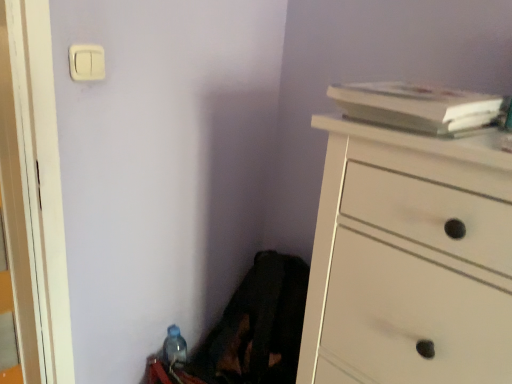
Describe the element at coordinates (174, 348) in the screenshot. I see `translucent plastic bottle at lower left` at that location.

Based on the photo, in order to face white matte book at upper right, should I rotate leftwards or rightwards?

Rotate right and turn 20.868 degrees.

You are a GUI agent. You are given a task and a screenshot of the screen. Output one action in this format:
    pyautogui.click(x=<x>, y=<y>)
    Task: Click on the white wood chest of drawers at right
    This screenshot has width=512, height=384.
    Given the screenshot: What is the action you would take?
    410,259

Who is shorter, white wood chest of drawers at right or translucent plastic bottle at lower left?

translucent plastic bottle at lower left is shorter.

How different are the orientations of white wood chest of drawers at right and translucent plastic bottle at lower left in degrees?

The angle between the facing direction of white wood chest of drawers at right and the facing direction of translucent plastic bottle at lower left is 91.9 degrees.

Is the depth of white wood chest of drawers at right less than that of translucent plastic bottle at lower left?

Yes, it is in front of translucent plastic bottle at lower left.

Does white wood chest of drawers at right appear on the left side of translucent plastic bottle at lower left?

No.

Is white plastic light switch at upper left to the right of white wood chest of drawers at right from the viewer's perspective?

No.

From a real-world perspective, between white plastic light switch at upper left and white wood chest of drawers at right, who is vertically lower?

In real-world perspective, white wood chest of drawers at right is lower.

From the image's perspective, is white plastic light switch at upper left beneath white wood chest of drawers at right?

No, from the image's perspective, white plastic light switch at upper left is not below white wood chest of drawers at right.

What's the angular difference between white plastic light switch at upper left and white wood chest of drawers at right's facing directions?

There is a 91.1-degree angle between the facing directions of white plastic light switch at upper left and white wood chest of drawers at right.

Would you say white plastic light switch at upper left is to the left or to the right of translucent plastic bottle at lower left in the picture?

white plastic light switch at upper left is positioned on translucent plastic bottle at lower left's left side.

In the scene shown: Considering the sizes of objects white plastic light switch at upper left and translucent plastic bottle at lower left in the image provided, who is smaller, white plastic light switch at upper left or translucent plastic bottle at lower left?

With smaller size is white plastic light switch at upper left.

Which point is more forward, (82,57) or (170,339)?

The point (82,57) is closer to the camera.

Considering the sizes of objects white matte book at upper right and white plastic light switch at upper left in the image provided, who is taller, white matte book at upper right or white plastic light switch at upper left?

white matte book at upper right.

Is white matte book at upper right turned away from white plastic light switch at upper left?

white matte book at upper right is not turned away from white plastic light switch at upper left.

From the picture: From a real-world perspective, which is physically above, white matte book at upper right or white plastic light switch at upper left?

In real-world perspective, white plastic light switch at upper left is above.

Based on the photo, considering the sizes of white matte book at upper right and white plastic light switch at upper left in the image, is white matte book at upper right bigger or smaller than white plastic light switch at upper left?

Considering their sizes, white matte book at upper right takes up more space than white plastic light switch at upper left.

Can you confirm if translucent plastic bottle at lower left is wider than white plastic light switch at upper left?

Yes, translucent plastic bottle at lower left is wider than white plastic light switch at upper left.

Between point (167, 350) and point (76, 60), which one is positioned behind?

Point (167, 350)

Which of these two, translucent plastic bottle at lower left or white plastic light switch at upper left, is smaller?

With smaller size is white plastic light switch at upper left.

Looking at this image, is translucent plastic bottle at lower left inside the boundaries of white plastic light switch at upper left, or outside?

translucent plastic bottle at lower left is not enclosed by white plastic light switch at upper left.

Where is `book positioned vertically above the translucent plastic bottle at lower left (from a real-world perspective)`? book positioned vertically above the translucent plastic bottle at lower left (from a real-world perspective) is located at coordinates (416, 106).

Which object is closer to the camera taking this photo, white matte book at upper right or translucent plastic bottle at lower left?

white matte book at upper right is closer to the camera.

Between white matte book at upper right and translucent plastic bottle at lower left, which one has smaller width?

translucent plastic bottle at lower left is thinner.

How many degrees apart are the facing directions of white matte book at upper right and translucent plastic bottle at lower left?

89.4 degrees.

Considering the positions of objects white wood chest of drawers at right and white plastic light switch at upper left in the image provided, who is behind, white wood chest of drawers at right or white plastic light switch at upper left?

white plastic light switch at upper left is further from the camera.

From a real-world perspective, between white wood chest of drawers at right and white plastic light switch at upper left, who is vertically higher?

white plastic light switch at upper left is physically above.

Can you confirm if white wood chest of drawers at right is shorter than white plastic light switch at upper left?

Incorrect, the height of white wood chest of drawers at right does not fall short of that of white plastic light switch at upper left.

Considering the positions of objects white wood chest of drawers at right and white plastic light switch at upper left in the image provided, who is more to the left, white wood chest of drawers at right or white plastic light switch at upper left?

Positioned to the left is white plastic light switch at upper left.

Where is `chest of drawers above the translucent plastic bottle at lower left (from a real-world perspective)`? The width and height of the screenshot is (512, 384). chest of drawers above the translucent plastic bottle at lower left (from a real-world perspective) is located at coordinates (410, 259).

Image resolution: width=512 pixels, height=384 pixels. I want to click on light switch behind the white wood chest of drawers at right, so click(x=86, y=62).

Which object lies further to the anchor point translucent plastic bottle at lower left, white plastic light switch at upper left or white wood chest of drawers at right?

Among the two, white plastic light switch at upper left is located further to translucent plastic bottle at lower left.

Based on their spatial positions, is white wood chest of drawers at right or white plastic light switch at upper left closer to translucent plastic bottle at lower left?

The object closer to translucent plastic bottle at lower left is white wood chest of drawers at right.

From the image, which object appears to be nearer to white matte book at upper right, translucent plastic bottle at lower left or white plastic light switch at upper left?

white plastic light switch at upper left.

Estimate the real-world distances between objects in this image. Which object is further from white matte book at upper right, white plastic light switch at upper left or white wood chest of drawers at right?

Among the two, white plastic light switch at upper left is located further to white matte book at upper right.

Which object lies nearer to the anchor point white plastic light switch at upper left, white wood chest of drawers at right or white matte book at upper right?

white matte book at upper right lies closer to white plastic light switch at upper left than the other object.

Estimate the real-world distances between objects in this image. Which object is further from white plastic light switch at upper left, white matte book at upper right or translucent plastic bottle at lower left?

Among the two, translucent plastic bottle at lower left is located further to white plastic light switch at upper left.

Based on their spatial positions, is translucent plastic bottle at lower left or white wood chest of drawers at right closer to white matte book at upper right?

The object closer to white matte book at upper right is white wood chest of drawers at right.

Estimate the real-world distances between objects in this image. Which object is further from white matte book at upper right, white wood chest of drawers at right or white plastic light switch at upper left?

Among the two, white plastic light switch at upper left is located further to white matte book at upper right.

At what (x,y) coordinates should I click in order to perform the action: click on the chest of drawers between white plastic light switch at upper left and translucent plastic bottle at lower left vertically. Please return your answer as a coordinate pair (x, y). This screenshot has width=512, height=384. Looking at the image, I should click on tap(410, 259).

Where is `book between white wood chest of drawers at right and translucent plastic bottle at lower left in the front-back direction`? Image resolution: width=512 pixels, height=384 pixels. book between white wood chest of drawers at right and translucent plastic bottle at lower left in the front-back direction is located at coordinates (416, 106).

You are a GUI agent. You are given a task and a screenshot of the screen. Output one action in this format:
    pyautogui.click(x=<x>, y=<y>)
    Task: Click on the book between white plastic light switch at upper left and white wood chest of drawers at right from left to right
    This screenshot has height=384, width=512.
    Given the screenshot: What is the action you would take?
    pyautogui.click(x=416, y=106)

The width and height of the screenshot is (512, 384). I want to click on book that lies between white plastic light switch at upper left and translucent plastic bottle at lower left from top to bottom, so click(416, 106).